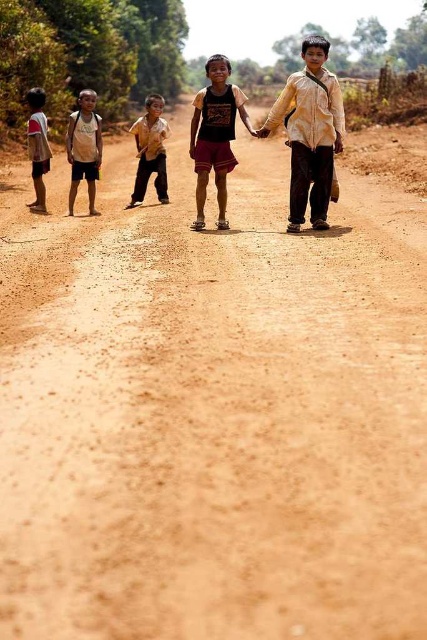
Question: Is white cotton shirt at left behind light brown cotton shirt at left?

Choices:
 (A) yes
 (B) no

Answer: (B)

Question: Is dark brown cotton shorts at center positioned before light brown cotton shirt at left?

Choices:
 (A) yes
 (B) no

Answer: (A)

Question: Which of the following is the closest to the observer?

Choices:
 (A) light brown cotton shirt at left
 (B) white cotton shirt at left

Answer: (B)

Question: Does yellow cotton shirt at center appear over light brown cotton shirt at left?

Choices:
 (A) yes
 (B) no

Answer: (A)

Question: Which of the following is the closest to the observer?

Choices:
 (A) yellow cotton shirt at center
 (B) white cotton shirt at left
 (C) brown cotton shirt at center
 (D) dark brown cotton shorts at center

Answer: (A)

Question: Which object is farther from the camera taking this photo?

Choices:
 (A) white cotton shirt at left
 (B) brown cotton shirt at center
 (C) light brown cotton shirt at left

Answer: (B)